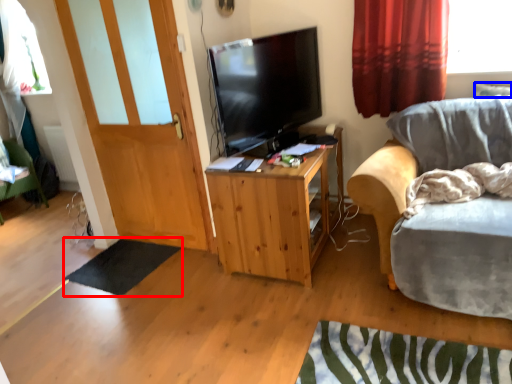
Question: Among these objects, which one is farthest to the camera, flat (highlighted by a red box) or pillow (highlighted by a blue box)?

Choices:
 (A) flat
 (B) pillow

Answer: (A)